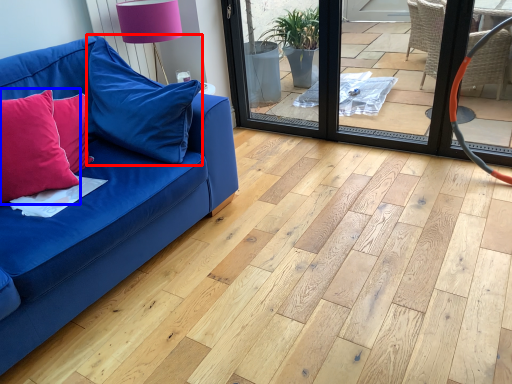
Question: Which object appears closest to the camera in this image, pillow (highlighted by a red box) or pillow (highlighted by a blue box)?

Choices:
 (A) pillow
 (B) pillow

Answer: (B)